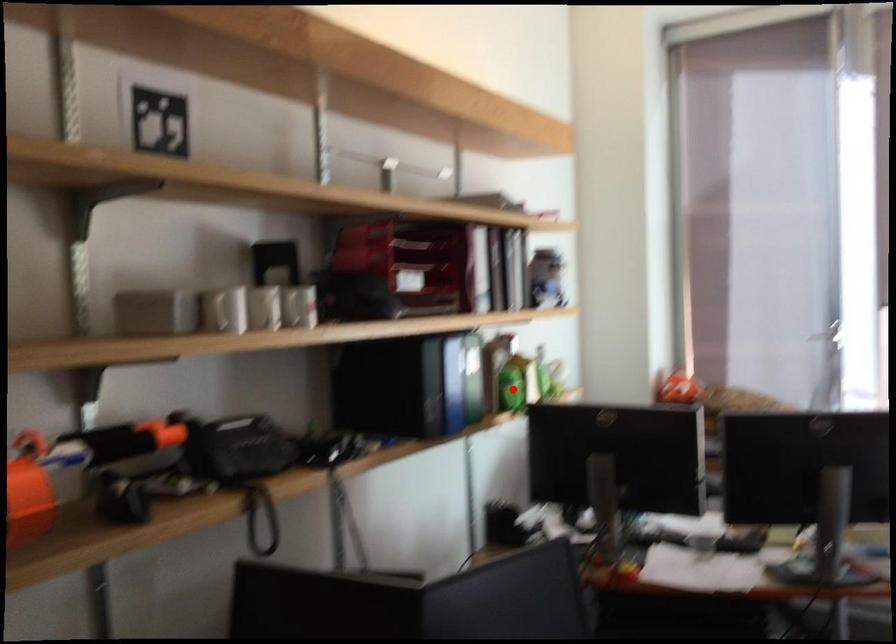
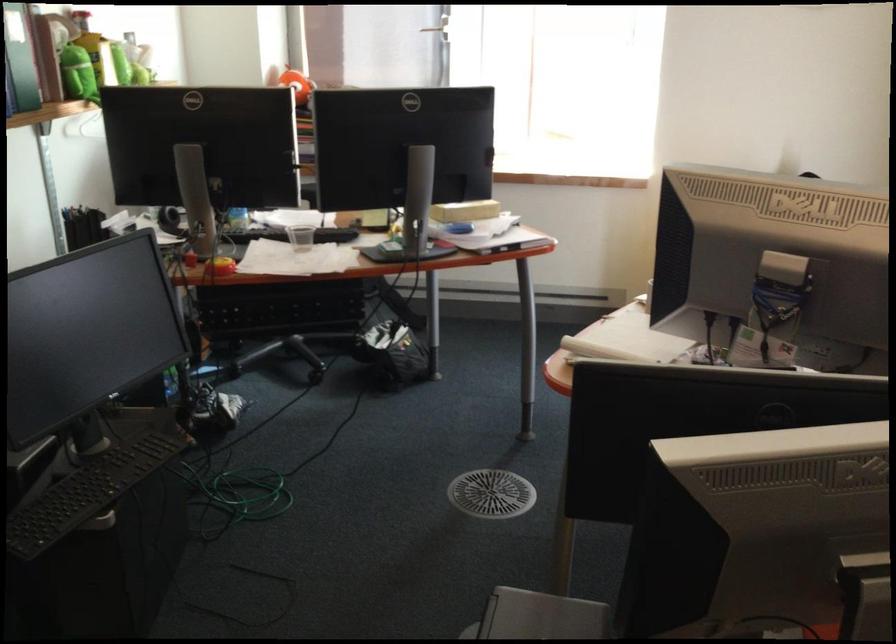
Question: I am providing you with two images of the same scene from different viewpoints. Given a red point in image1, look at the same physical point in image2. Is it:

Choices:
 (A) Closer to the viewpoint
 (B) Farther from the viewpoint

Answer: (A)